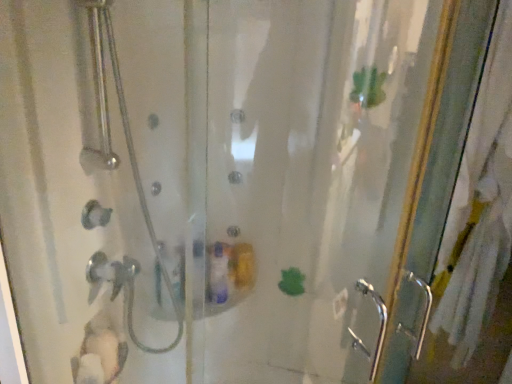
Question: From the image's perspective, is clear glass shower door at left above clear glass screen door at right?

Choices:
 (A) yes
 (B) no

Answer: (A)

Question: Can you confirm if clear glass shower door at left is positioned to the left of clear glass screen door at right?

Choices:
 (A) no
 (B) yes

Answer: (B)

Question: Considering the relative sizes of clear glass shower door at left and clear glass screen door at right in the image provided, is clear glass shower door at left shorter than clear glass screen door at right?

Choices:
 (A) yes
 (B) no

Answer: (A)

Question: Is clear glass shower door at left smaller than clear glass screen door at right?

Choices:
 (A) no
 (B) yes

Answer: (B)

Question: Is clear glass shower door at left looking in the opposite direction of clear glass screen door at right?

Choices:
 (A) no
 (B) yes

Answer: (A)

Question: Could clear glass screen door at right be considered to be inside clear glass shower door at left?

Choices:
 (A) yes
 (B) no

Answer: (B)

Question: Is clear glass screen door at right at the left side of clear glass shower door at left?

Choices:
 (A) no
 (B) yes

Answer: (A)

Question: Could you tell me if clear glass screen door at right is turned towards clear glass shower door at left?

Choices:
 (A) yes
 (B) no

Answer: (B)

Question: Is clear glass screen door at right closer to the viewer compared to clear glass shower door at left?

Choices:
 (A) yes
 (B) no

Answer: (B)

Question: Can you confirm if clear glass screen door at right is smaller than clear glass shower door at left?

Choices:
 (A) yes
 (B) no

Answer: (B)

Question: From a real-world perspective, is clear glass screen door at right on clear glass shower door at left?

Choices:
 (A) yes
 (B) no

Answer: (B)

Question: From a real-world perspective, is clear glass screen door at right physically below clear glass shower door at left?

Choices:
 (A) yes
 (B) no

Answer: (A)

Question: Based on their positions, is clear glass shower door at left located to the left or right of clear glass screen door at right?

Choices:
 (A) right
 (B) left

Answer: (B)